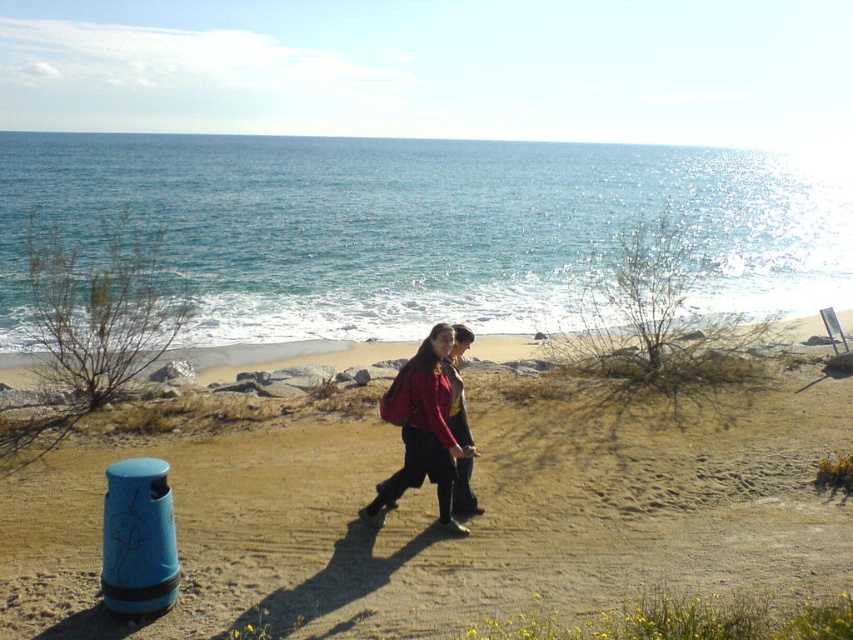
You are standing at the point marked by the coordinates point (425, 227). Looking around, you see blue water at upper center. Which direction should you walk to reach the blue water at upper center from your current position?

The point marked by the coordinates point (425, 227) is already at the blue water at upper center, so you are already there.

You are standing at the starting point of the sandy path and want to reach the brown sandy beach at center. Which direction should you move relative to the matte red jacket at center?

The brown sandy beach at center is located below the matte red jacket at center, so you should move downward towards the brown sandy beach at center to reach it.